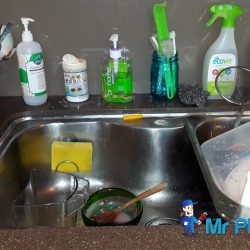
Where is `sponge holder`? This screenshot has width=250, height=250. sponge holder is located at coordinates (73, 163).